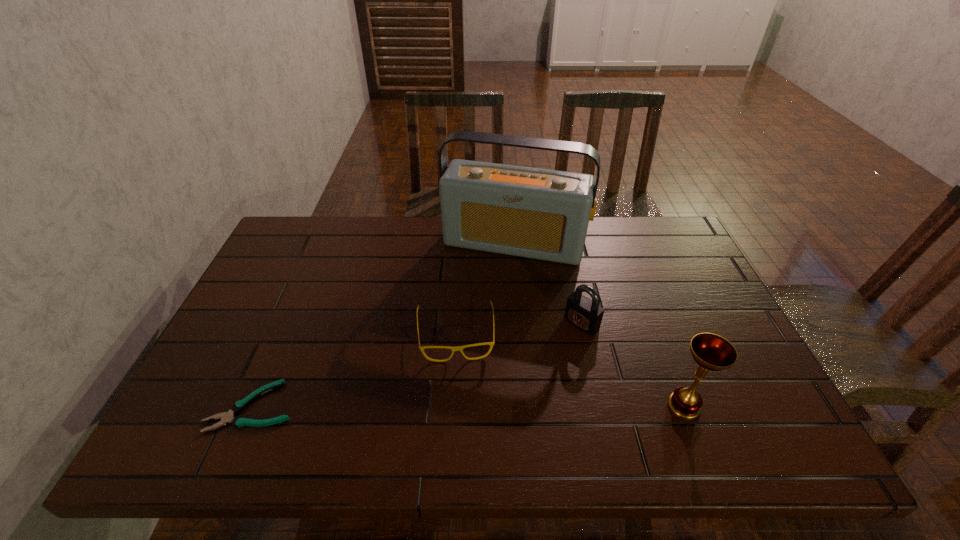
Where is `vacant space located on the front-facing side of the farthest object`? vacant space located on the front-facing side of the farthest object is located at coordinates (481, 318).

The height and width of the screenshot is (540, 960). In order to click on blank space located on the front-facing side of the farthest object in this screenshot , I will do `click(463, 372)`.

The image size is (960, 540). Find the location of `vacant position located 0.120m on the front-facing side of the farthest object`. vacant position located 0.120m on the front-facing side of the farthest object is located at coordinates (489, 293).

Where is `vacant space positioned 0.090m in front of the lenses of the spectacles`? The image size is (960, 540). vacant space positioned 0.090m in front of the lenses of the spectacles is located at coordinates (459, 395).

Where is `vacant area situated in front of the lenses of the spectacles`? vacant area situated in front of the lenses of the spectacles is located at coordinates (458, 383).

Where is `free region located 0.080m in front of the lenses of the spectacles`? free region located 0.080m in front of the lenses of the spectacles is located at coordinates point(458,391).

The width and height of the screenshot is (960, 540). In order to click on free location located on the front of the padlock near the keyhole in this screenshot , I will do `click(547, 354)`.

Locate an element on the screen. The image size is (960, 540). vacant region located 0.280m on the front of the padlock near the keyhole is located at coordinates (498, 398).

At what (x,y) coordinates should I click in order to perform the action: click on blank area located on the front of the padlock near the keyhole. Please return your answer as a coordinate pair (x, y). Looking at the image, I should click on (507, 390).

At what (x,y) coordinates should I click in order to perform the action: click on object located at the far edge. Please return your answer as a coordinate pair (x, y). The width and height of the screenshot is (960, 540). Looking at the image, I should click on (543, 214).